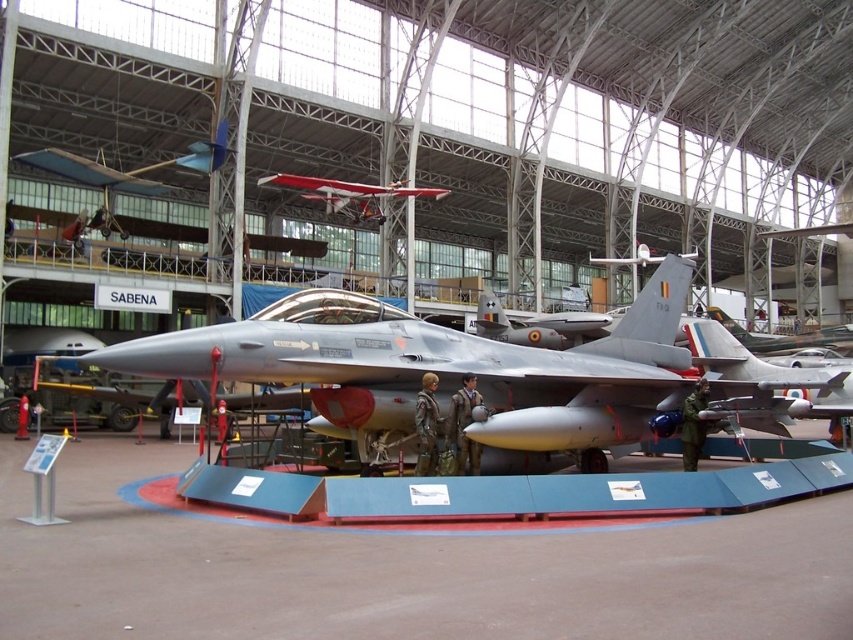
You are a tour guide explaining the layout of the hangar to visitors. You point to the silver metallic fighter jet at center and the red matte biplane at upper center. Which aircraft is positioned closer to the entrance of the hangar?

The silver metallic fighter jet at center is closer to the viewer than the red matte biplane at upper center, so it is positioned closer to the entrance of the hangar.

You are standing in the aviation museum and want to take a photo of the silver metallic fighter jet at center. If you are positioned at the entrance of the hangar, which is located at the bottom edge of the image, where should you aim your camera to capture the fighter jet in the center?

You should aim your camera towards the center of the image, where the silver metallic fighter jet at center is located at point coordinates approximately 0.577 on the x axis and 0.521 on the y axis.

Based on the photo, you are a tour guide explaining the layout of the aviation museum to visitors. Pointing to the silver metallic fighter jet at center and the red matte biplane at upper center, you want to describe their positions relative to each other. How would you phrase this?

The silver metallic fighter jet at center is positioned below the red matte biplane at upper center.